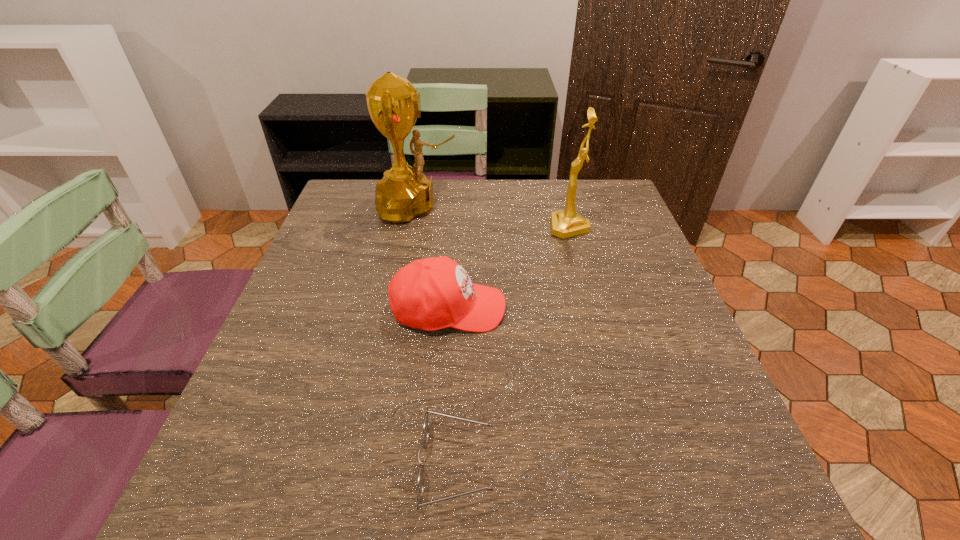
Locate an element on the screen. The height and width of the screenshot is (540, 960). the left award is located at coordinates [393, 103].

The image size is (960, 540). Identify the location of the third shortest object. (564, 224).

You are a GUI agent. You are given a task and a screenshot of the screen. Output one action in this format:
    pyautogui.click(x=<x>, y=<y>)
    Task: Click on the rightmost object
    
    Given the screenshot: What is the action you would take?
    pyautogui.click(x=564, y=224)

Find the location of a particular element. This screenshot has height=540, width=960. the second shortest object is located at coordinates (434, 293).

Locate an element on the screen. This screenshot has height=540, width=960. baseball cap is located at coordinates (434, 293).

Find the location of a particular element. Image resolution: width=960 pixels, height=540 pixels. the shortest object is located at coordinates (425, 427).

Where is `the nearest object`? The width and height of the screenshot is (960, 540). the nearest object is located at coordinates [x=425, y=427].

The image size is (960, 540). What are the coordinates of `vacant space located on the front side of the left award` in the screenshot? It's located at (542, 207).

At what (x,y) coordinates should I click in order to perform the action: click on free region located on the front-facing side of the shorter award. Please return your answer as a coordinate pair (x, y). Image resolution: width=960 pixels, height=540 pixels. Looking at the image, I should click on (420, 227).

Find the location of `vacant region located on the front-facing side of the shorter award`. vacant region located on the front-facing side of the shorter award is located at coordinates (468, 227).